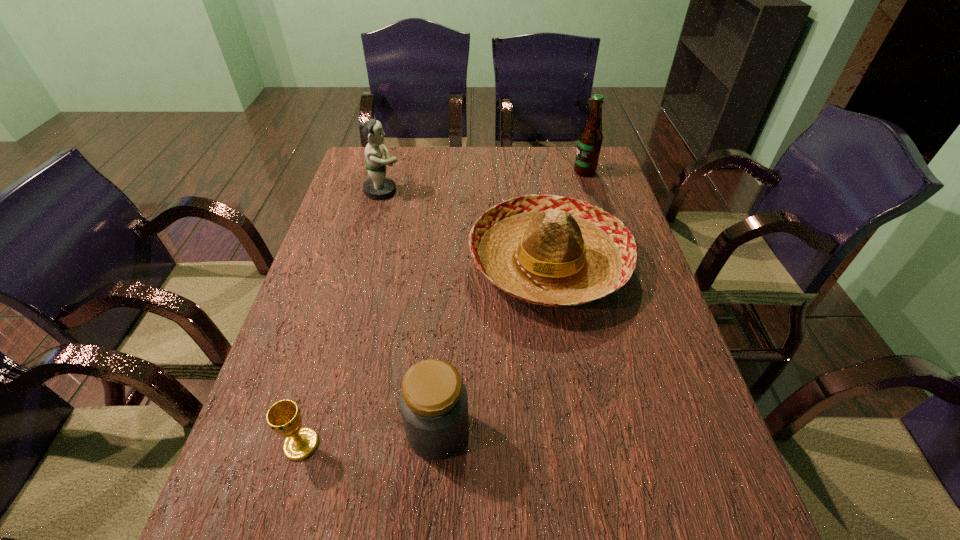
Identify the location of vacant space at the far edge. The height and width of the screenshot is (540, 960). (516, 181).

This screenshot has height=540, width=960. I want to click on free spot at the left edge of the desktop, so click(297, 325).

Where is `vacant space at the right edge`? Image resolution: width=960 pixels, height=540 pixels. vacant space at the right edge is located at coordinates 607,310.

This screenshot has width=960, height=540. I want to click on vacant point located between the second farthest object and the farthest object, so click(x=484, y=181).

Locate an element on the screen. empty space that is in between the jar and the chalice is located at coordinates (370, 437).

Where is `unoccupied position between the second farthest object and the farthest object`? This screenshot has height=540, width=960. unoccupied position between the second farthest object and the farthest object is located at coordinates (484, 181).

Where is `free spot between the jar and the figurine`? free spot between the jar and the figurine is located at coordinates (411, 310).

At what (x,y) coordinates should I click in order to perform the action: click on free space between the jar and the sombrero. Please return your answer as a coordinate pair (x, y). Looking at the image, I should click on (493, 347).

The height and width of the screenshot is (540, 960). I want to click on vacant space in between the sombrero and the chalice, so click(425, 354).

Locate an element on the screen. The image size is (960, 540). free space between the shortest object and the sombrero is located at coordinates (425, 354).